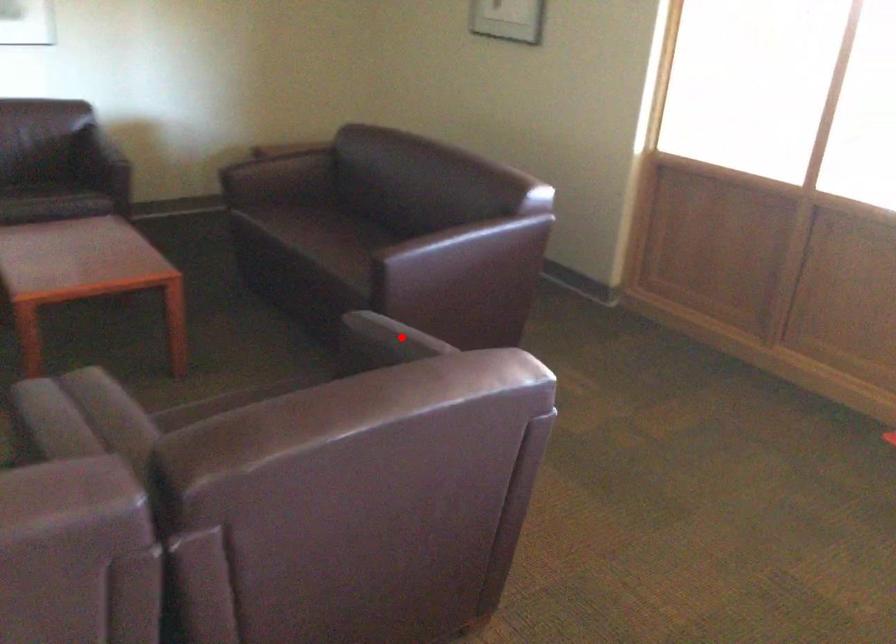
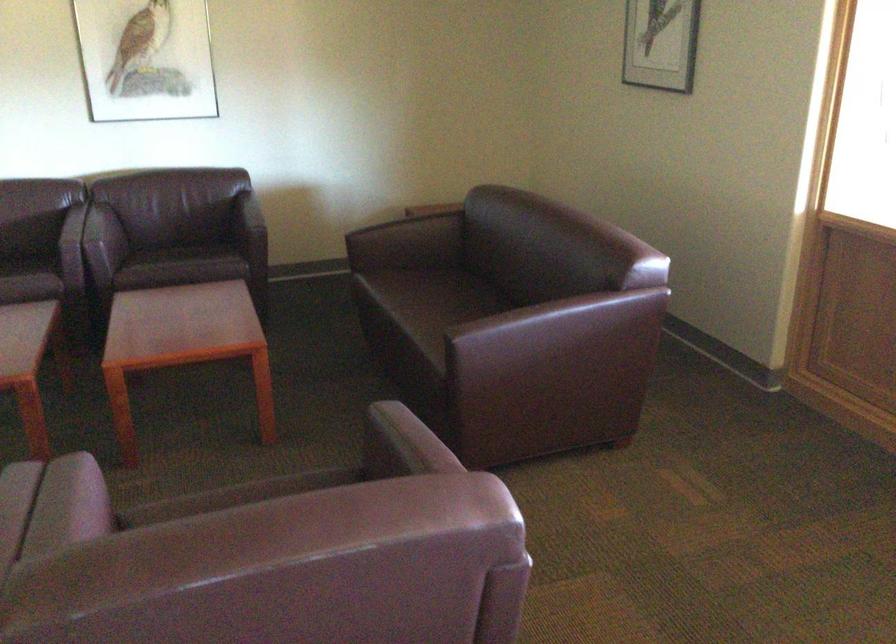
Question: I am providing you with two images of the same scene from different viewpoints. Image1 has a red point marked. In image2, the corresponding 3D location appears at what relative position? Reply with the corresponding letter.

Choices:
 (A) Closer
 (B) Farther

Answer: (A)